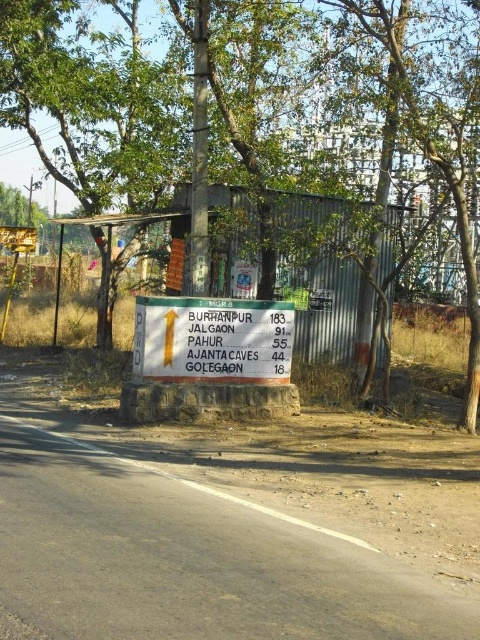
Does point (178, 17) come closer to viewer compared to point (12, 289)?

Yes, it is.

Between green leafy tree at center and yellow plastic pole at left, which one appears on the left side from the viewer's perspective?

yellow plastic pole at left

You are a GUI agent. You are given a task and a screenshot of the screen. Output one action in this format:
    pyautogui.click(x=<x>, y=<y>)
    Task: Click on the green leafy tree at center
    The width and height of the screenshot is (480, 640).
    Given the screenshot: What is the action you would take?
    pyautogui.click(x=351, y=93)

Does white plastic sign at center appear under yellow plastic pole at left?

Yes.

Which is in front, point (191, 362) or point (13, 268)?

Point (191, 362) is more forward.

You are a GUI agent. You are given a task and a screenshot of the screen. Output one action in this format:
    pyautogui.click(x=<x>, y=<y>)
    Task: Click on the white plastic sign at center
    This screenshot has height=640, width=480.
    Given the screenshot: What is the action you would take?
    pyautogui.click(x=213, y=339)

Based on the photo, does green leafy tree at center appear on the left side of white plastic sign at center?

Yes, green leafy tree at center is to the left of white plastic sign at center.

Between point (303, 72) and point (237, 337), which one is positioned in front?

Point (237, 337) is in front.

The width and height of the screenshot is (480, 640). What are the coordinates of `green leafy tree at center` in the screenshot? It's located at (351, 93).